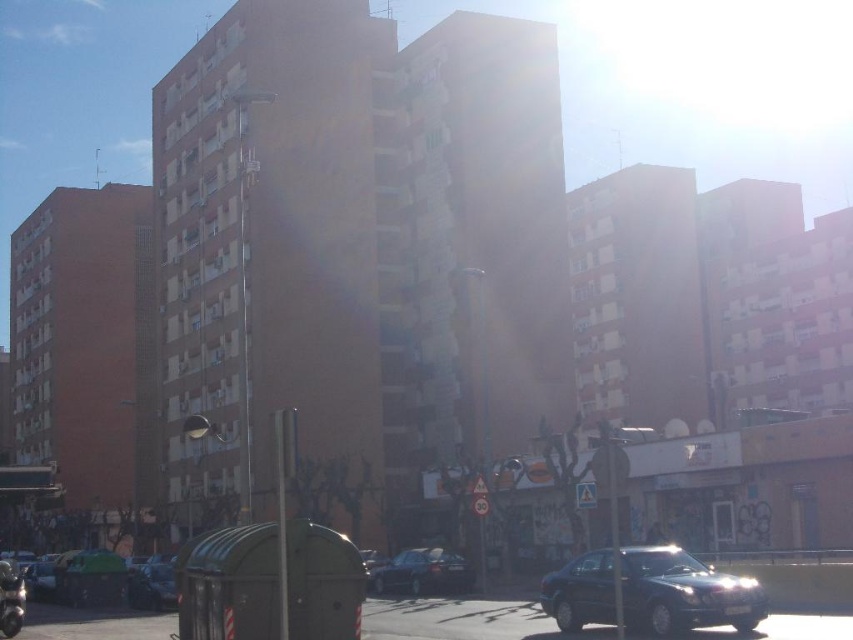
You are a delivery person needing to park your 5.5 meter long truck between the shiny black sedan at center and the shiny black car at lower left. Can you fit your truck in the space between them?

The distance between the shiny black sedan at center and the shiny black car at lower left is 7.56 meters. Since your truck is 5.5 meters long, there is enough space to park between them as 7.56 meters is greater than 5.5 meters.

Based on the scene description, what object is located at the coordinates point (683, 593)?

The point (683, 593) corresponds to the shiny dark blue sedan at center.

You are a delivery driver who needs to park your vehicle in this area. You have a shiny dark blue sedan at center and a shiny black car at lower left in the image. Which vehicle has more space available for parking next to it?

The shiny dark blue sedan at center has a larger size compared to the shiny black car at lower left, so there might be less space available next to it. The shiny black car at lower left is smaller, potentially offering more space for parking nearby.